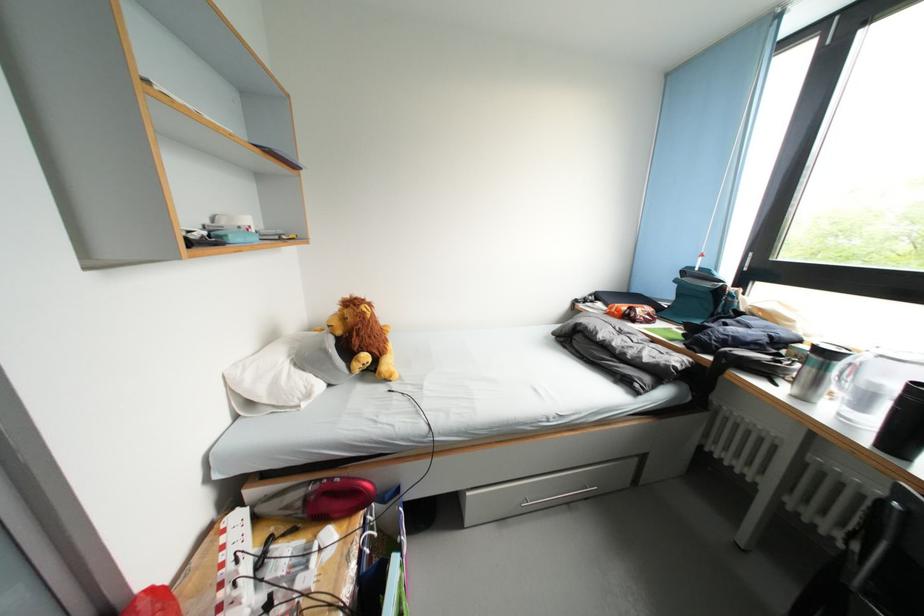
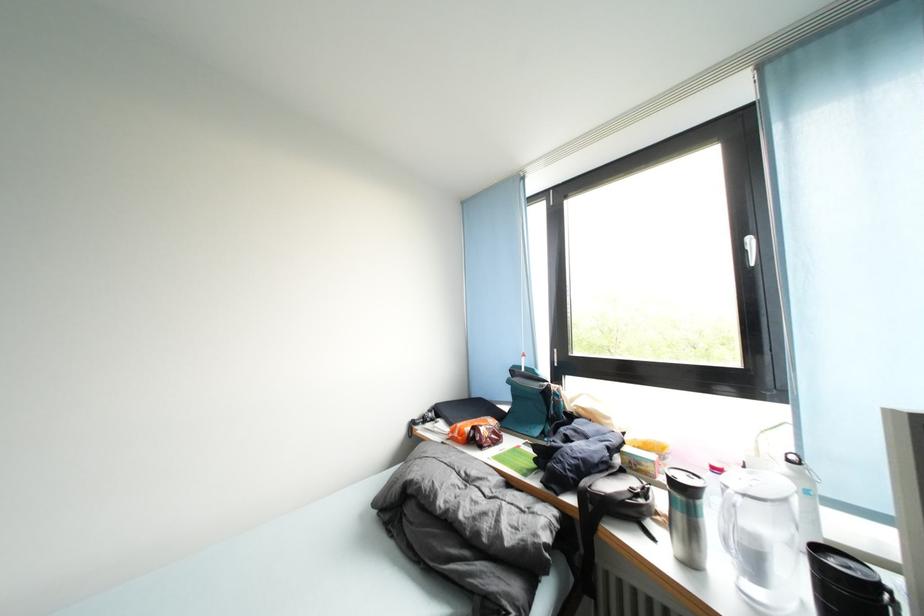
The point at (637, 322) is marked in the first image. Where is the corresponding point in the second image?

(482, 446)